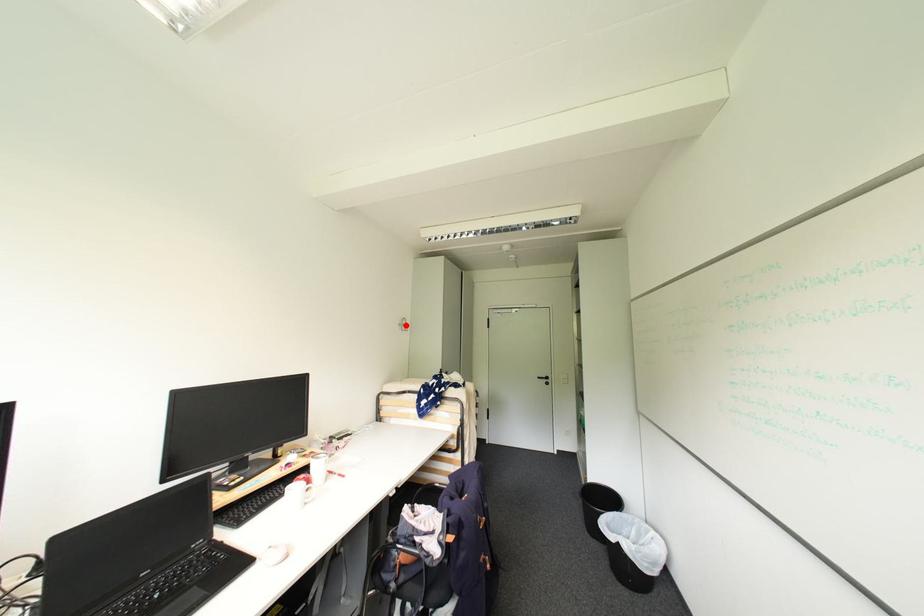
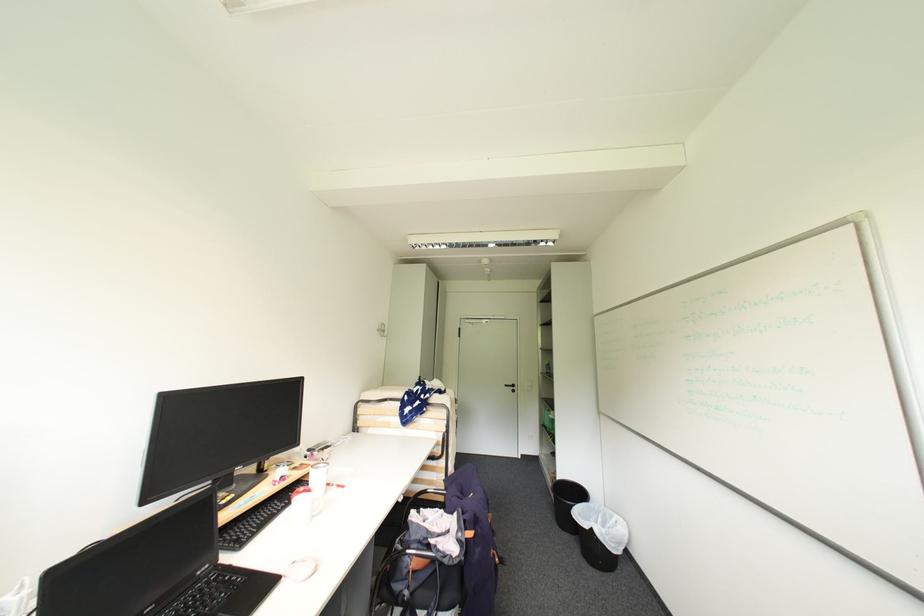
Locate, in the second image, the point that corresponds to the highlighted location in the first image.

(384, 331)